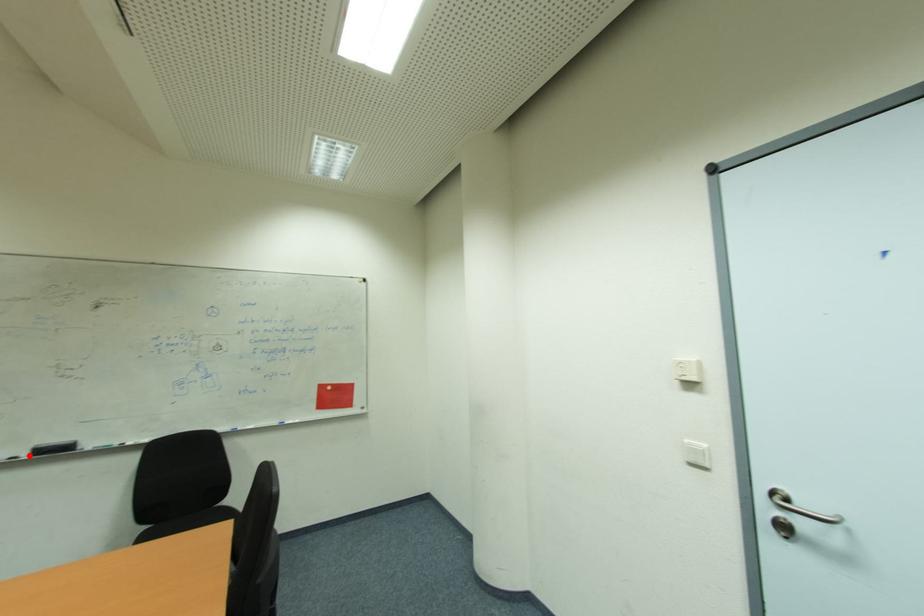
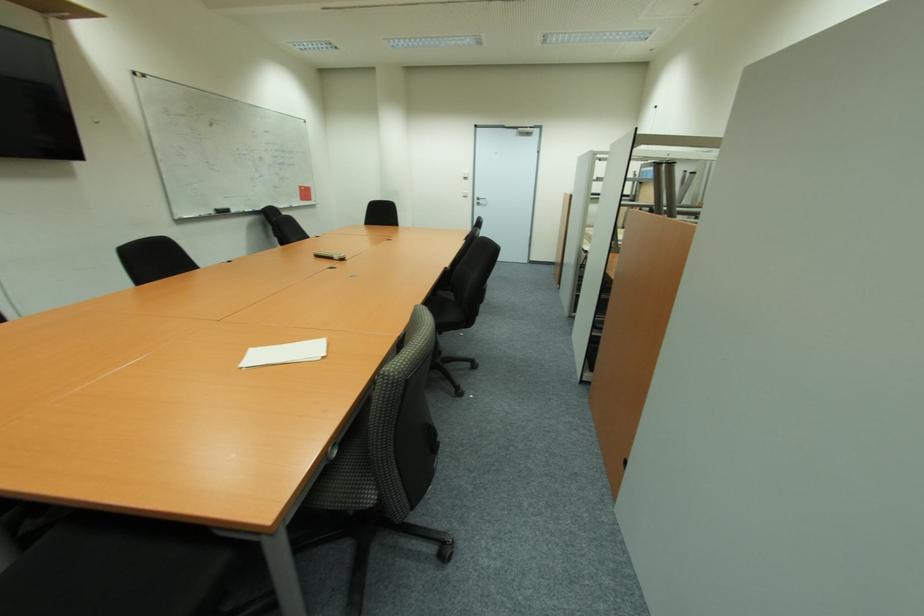
In the second image, find the point that corresponds to the highlighted location in the first image.

(215, 214)